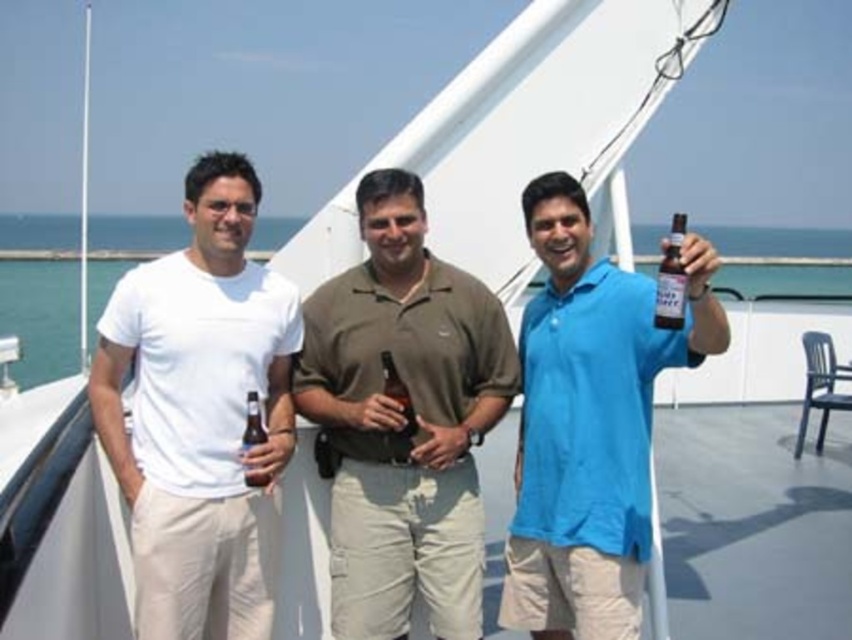
You are a photographer on the boat deck. You want to take a photo of the matte brown shirt at center and the brown glass bottle at center. Which object is positioned closer to the camera?

The matte brown shirt at center is closer to the viewer than the brown glass bottle at center, so the matte brown shirt at center would appear closer in the photo.

You are a photographer on the boat deck. You need to take a photo that includes both the matte brown shirt at center and the brown glass bottle at center. Which object should you focus on first to ensure both are in frame?

The matte brown shirt at center is taller than the brown glass bottle at center, so you should focus on the matte brown shirt at center first to ensure the entire height of both objects fits within the frame.